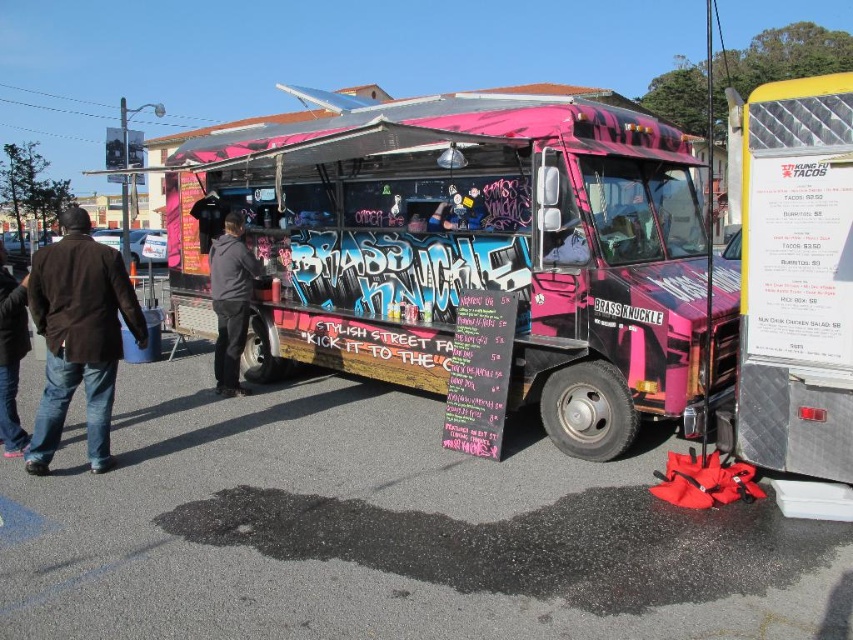
You are standing at the point marked by the coordinates (230, 300) in the image. What object are you currently standing on?

You are standing on the black matte jacket at center.

You are a customer waiting in line at the Brass Knuckle food truck. You notice two items hanging on a hook near the serving counter. They are the brown leather jacket at left and the jeans at left. Which item is smaller?

The brown leather jacket at left is smaller than the jeans at left.